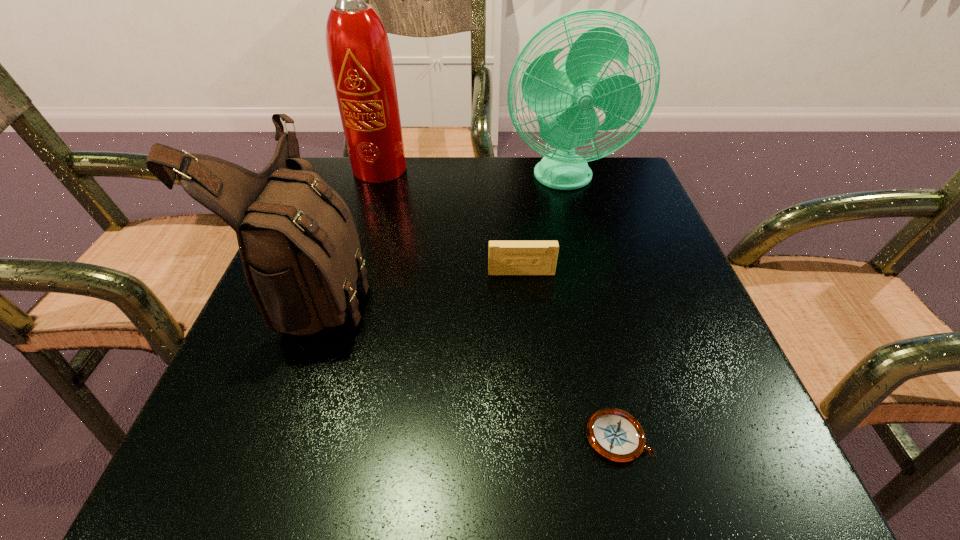
Image resolution: width=960 pixels, height=540 pixels. I want to click on vacant region between the fire extinguisher and the fan, so click(x=474, y=174).

Locate an element on the screen. This screenshot has height=540, width=960. free space between the fire extinguisher and the compass is located at coordinates (501, 303).

At what (x,y) coordinates should I click in order to perform the action: click on vacant area that lies between the fan and the compass. Please return your answer as a coordinate pair (x, y). The width and height of the screenshot is (960, 540). Looking at the image, I should click on (591, 308).

This screenshot has width=960, height=540. Identify the location of free area in between the fan and the fire extinguisher. (474, 174).

Find the location of a particular element. The image size is (960, 540). vacant region between the fan and the fire extinguisher is located at coordinates point(474,174).

Identify the location of blank region between the shoulder bag and the fan. The width and height of the screenshot is (960, 540). (444, 232).

The width and height of the screenshot is (960, 540). I want to click on object that stands as the second closest to the fan, so click(504, 257).

Where is `the third closest object relative to the fire extinguisher`? This screenshot has height=540, width=960. the third closest object relative to the fire extinguisher is located at coordinates (504, 257).

The width and height of the screenshot is (960, 540). In order to click on vacant area in the image that satisfies the following two spatial constraints: 1. on the front-facing side of the shoulder bag; 2. on the right side of the compass in this screenshot , I will do `click(267, 437)`.

Find the location of a particular element. Image resolution: width=960 pixels, height=540 pixels. free space that satisfies the following two spatial constraints: 1. on the front-facing side of the compass; 2. on the right side of the shoulder bag is located at coordinates (267, 437).